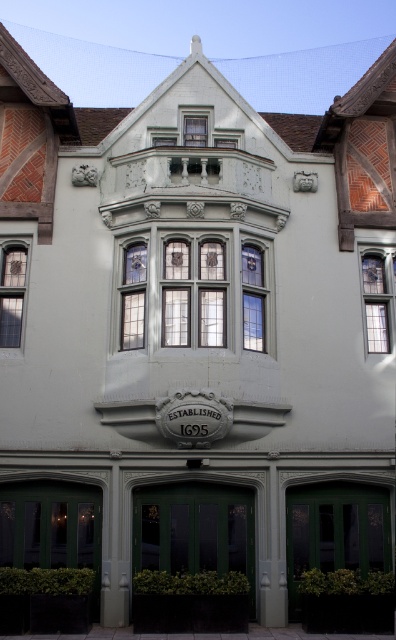
Identify the location of clear glass windows at center. This screenshot has width=396, height=640. (192, 291).

Identify the location of clear glass windows at center. (192, 291).

Where is `clear glass window at left`? This screenshot has width=396, height=640. clear glass window at left is located at coordinates (11, 292).

Can you confirm if clear glass window at left is taller than clear glass window at upper center?

In fact, clear glass window at left may be shorter than clear glass window at upper center.

Image resolution: width=396 pixels, height=640 pixels. Describe the element at coordinates (11, 292) in the screenshot. I see `clear glass window at left` at that location.

Where is `clear glass window at left`? clear glass window at left is located at coordinates point(11,292).

Is clear glass window at center right taller than clear glass window at upper center?

No, clear glass window at center right is not taller than clear glass window at upper center.

Can you confirm if clear glass window at center right is positioned below clear glass window at upper center?

Indeed, clear glass window at center right is positioned under clear glass window at upper center.

This screenshot has width=396, height=640. I want to click on clear glass window at center right, so click(378, 300).